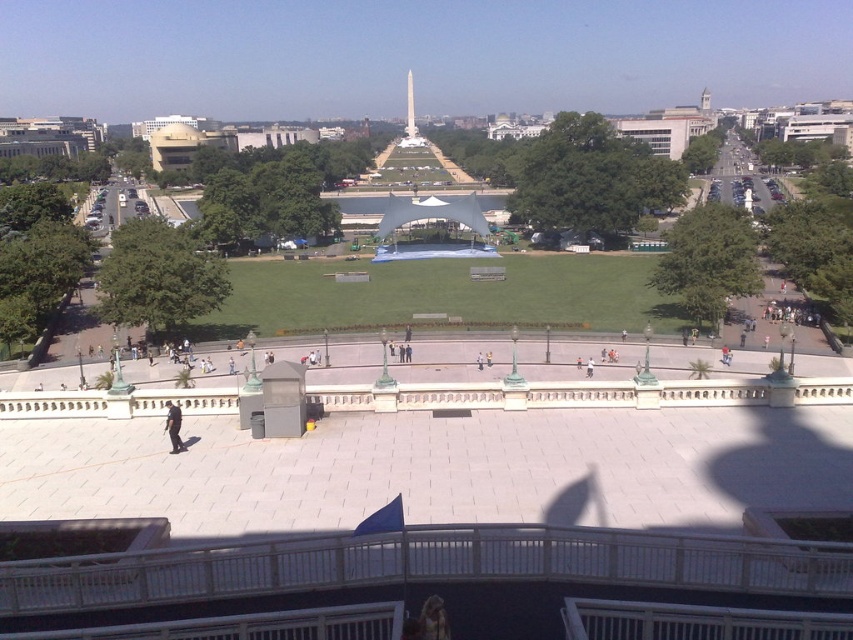
Question: Which point is closer to the camera?

Choices:
 (A) black uniformed officer at lower left
 (B) shiny gold monument at center

Answer: (A)

Question: Which point appears farthest from the camera in this image?

Choices:
 (A) (171, 442)
 (B) (410, 122)

Answer: (B)

Question: From the image, what is the correct spatial relationship of black uniformed officer at lower left in relation to shiny gold monument at center?

Choices:
 (A) below
 (B) above

Answer: (A)

Question: Does black uniformed officer at lower left appear on the left side of shiny gold monument at center?

Choices:
 (A) yes
 (B) no

Answer: (B)

Question: Among these points, which one is nearest to the camera?

Choices:
 (A) (178, 424)
 (B) (410, 109)

Answer: (A)

Question: Can you confirm if black uniformed officer at lower left is positioned above shiny gold monument at center?

Choices:
 (A) yes
 (B) no

Answer: (B)